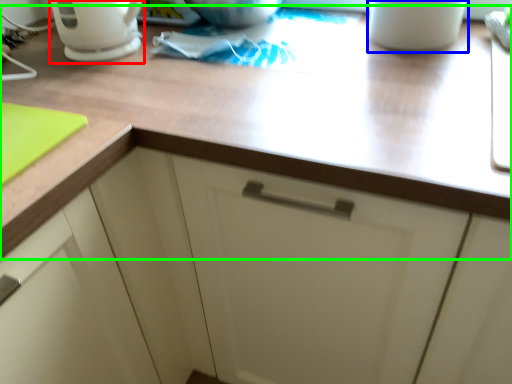
Question: Which object is positioned closest to coffeepot (highlighted by a red box)? Select from mug (highlighted by a blue box) and countertop (highlighted by a green box).

Choices:
 (A) mug
 (B) countertop

Answer: (B)